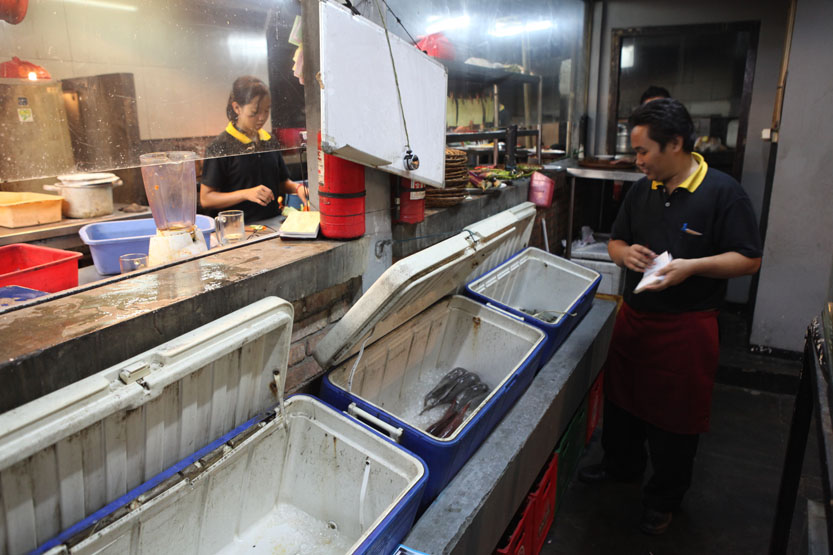
The image size is (833, 555). Find the location of `plastic crates`. plastic crates is located at coordinates (596, 410), (580, 423), (520, 529), (542, 504).